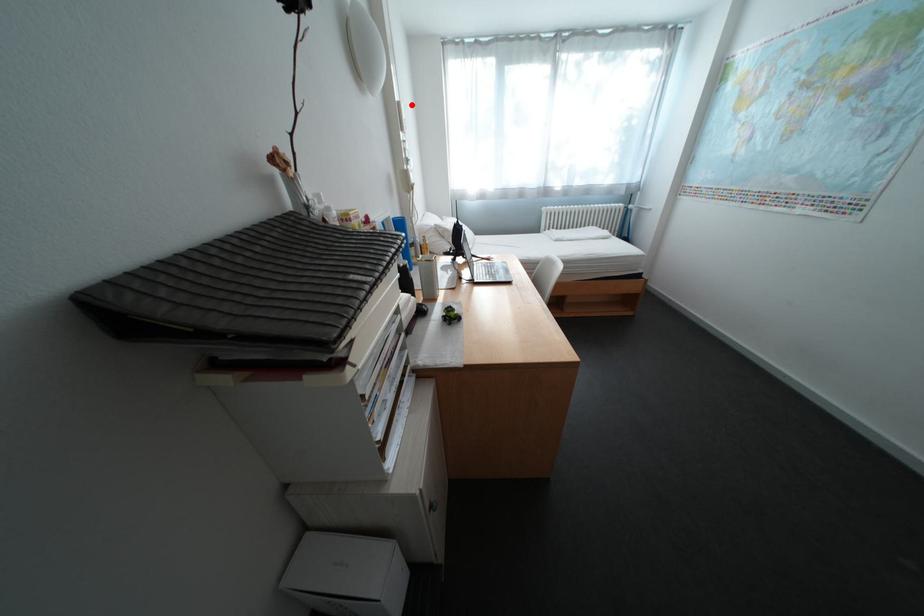
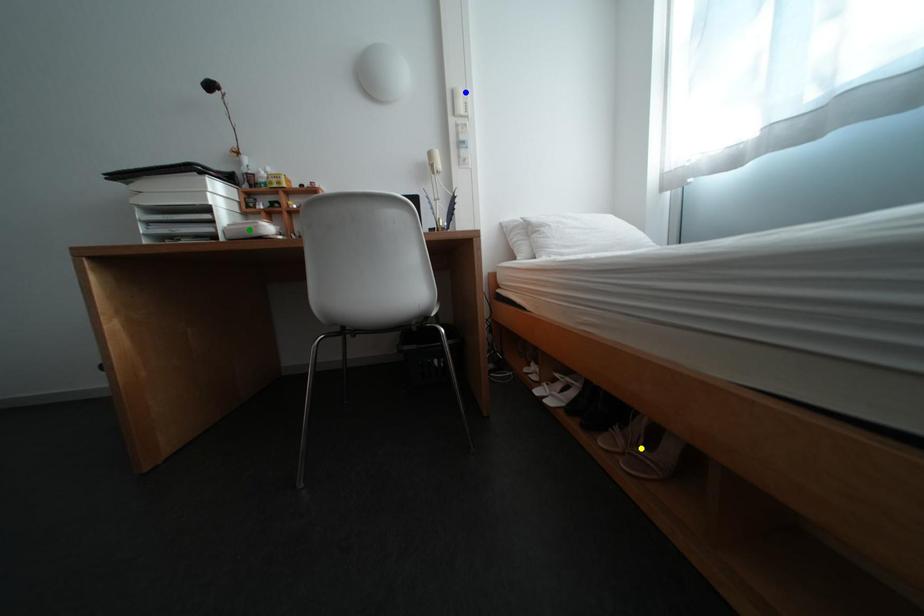
Question: I am providing you with two images of the same scene from different viewpoints. A red point is marked on the first image. You are given multiple points on the second image. Which spot in image 2 lines up with the point in image 1?

Choices:
 (A) yellow point
 (B) blue point
 (C) green point

Answer: (B)